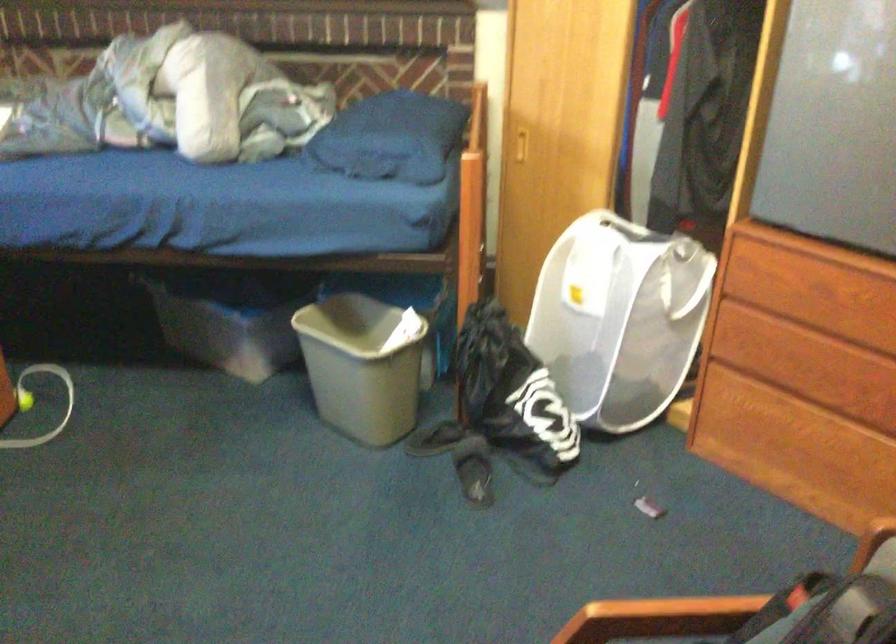
The image size is (896, 644). What are the coordinates of `wooden chair armrest` in the screenshot? It's located at (757, 614).